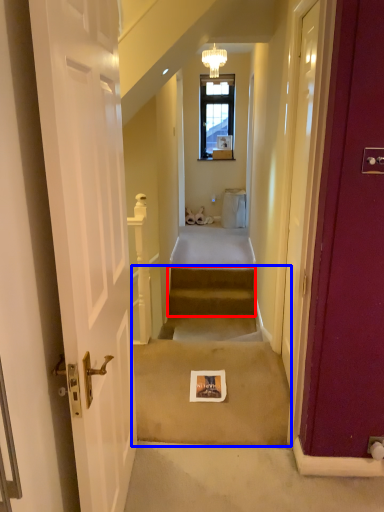
Question: Which of the following is the farthest to the observer, stairs (highlighted by a red box) or stairwell (highlighted by a blue box)?

Choices:
 (A) stairs
 (B) stairwell

Answer: (A)